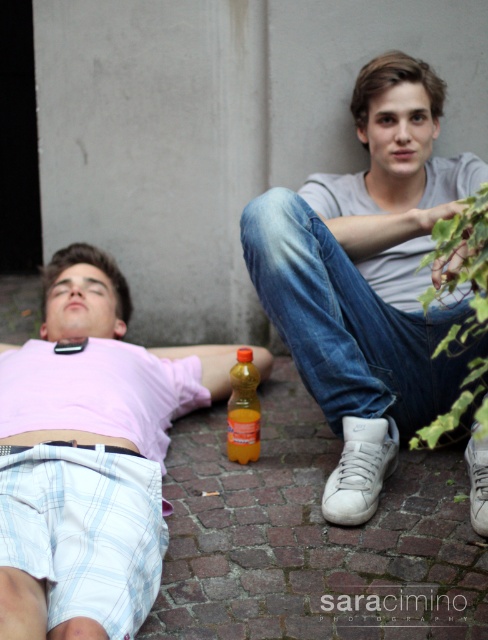
Question: Which is farther from the translucent orange bottle at center?

Choices:
 (A) white matte sneakers at lower right
 (B) white plaid shorts at lower left

Answer: (A)

Question: Which object is positioned farthest from the white plaid shorts at lower left?

Choices:
 (A) white matte sneakers at lower right
 (B) translucent orange bottle at center

Answer: (A)

Question: Is the position of white plaid shorts at lower left less distant than that of translucent orange bottle at center?

Choices:
 (A) yes
 (B) no

Answer: (A)

Question: Which point is closer to the camera?

Choices:
 (A) (92, 356)
 (B) (257, 412)
 (C) (284, 241)

Answer: (C)

Question: Can you confirm if white matte sneakers at lower right is positioned above white plaid shorts at lower left?

Choices:
 (A) no
 (B) yes

Answer: (B)

Question: Does white matte sneakers at lower right appear on the right side of white plaid shorts at lower left?

Choices:
 (A) no
 (B) yes

Answer: (B)